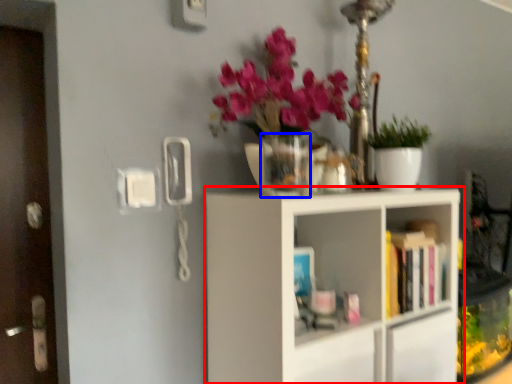
Question: Which object is closer to the camera taking this photo, shelf (highlighted by a red box) or vase (highlighted by a blue box)?

Choices:
 (A) shelf
 (B) vase

Answer: (A)